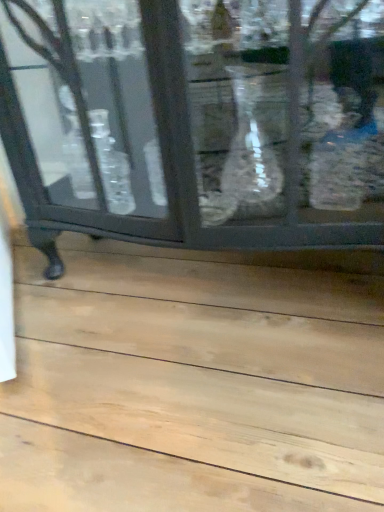
Where is `free space in front of matte glass cabinet at center`? Image resolution: width=384 pixels, height=512 pixels. free space in front of matte glass cabinet at center is located at coordinates (197, 391).